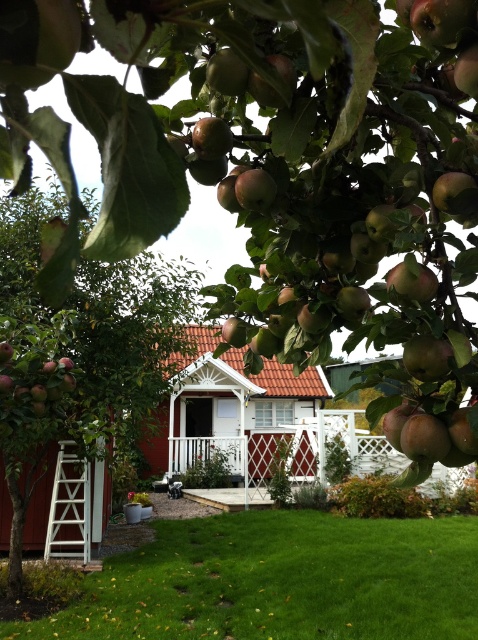
Is green grass at lower center wider than red wood barn at center?

No.

Is point (464, 550) positioned behind point (328, 396)?

No, it is not.

The height and width of the screenshot is (640, 478). What are the coordinates of `green grass at lower center` in the screenshot? It's located at (281, 580).

From the picture: Can you confirm if green grass at lower center is positioned to the right of shiny red apple at lower left?

Indeed, green grass at lower center is positioned on the right side of shiny red apple at lower left.

Can you confirm if green grass at lower center is bigger than shiny red apple at lower left?

No.

Which is behind, point (311, 625) or point (11, 388)?

The point (311, 625) is more distant.

Locate an element on the screen. green grass at lower center is located at coordinates (281, 580).

The width and height of the screenshot is (478, 640). What are the coordinates of `green glossy apples at left` in the screenshot? It's located at (79, 353).

Image resolution: width=478 pixels, height=640 pixels. What are the coordinates of `green glossy apples at left` in the screenshot? It's located at (79, 353).